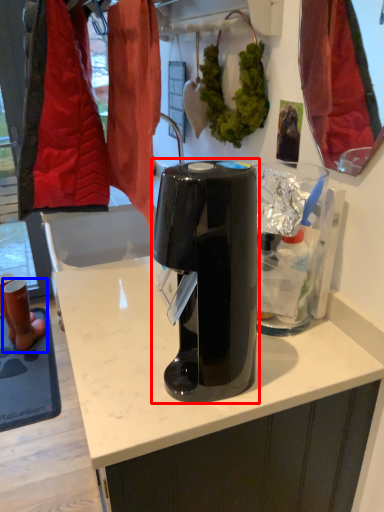
Question: Which of the following is the farthest to the observer, home appliance (highlighted by a red box) or footwear (highlighted by a blue box)?

Choices:
 (A) home appliance
 (B) footwear

Answer: (B)